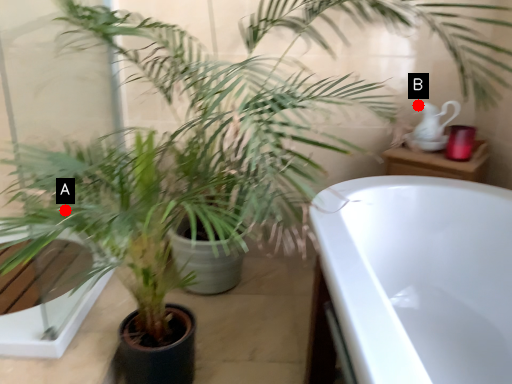
Question: Two points are circled on the image, labeled by A and B beside each circle. Which of the following is the farthest from the observer?

Choices:
 (A) A is further
 (B) B is further

Answer: (B)